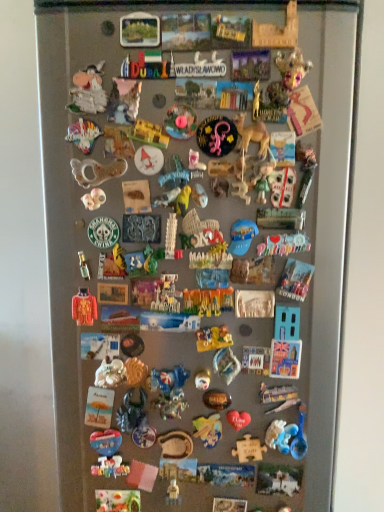
Question: Based on their sizes in the image, would you say white plastic puzzle piece at center-right, acting as the 15th toy starting from the bottom, is bigger or smaller than matte brown figurine at center, positioned as the 13th toy in bottom-to-top order?

Choices:
 (A) big
 (B) small

Answer: (A)

Question: Does point (274, 310) appear closer or farther from the camera than point (125, 343)?

Choices:
 (A) closer
 (B) farther

Answer: (A)

Question: Estimate the real-world distances between objects in this image. Which object is farther from the wooden puzzle piece at center, the 4th toy in the bottom-to-top sequence?

Choices:
 (A) white matte figurine at center, the eleventh toy when ordered from top to bottom
 (B) pink plastic toy at center, which is counted as the 34th toy, starting from the bottom
 (C) multicolored plastic toy at center, acting as the 18th toy starting from the bottom
 (D) wooden letter at center, the 38th toy ordered from the bottom
 (E) metallic silver spoon at upper left, acting as the 32th toy starting from the bottom

Answer: (D)

Question: Which object is the closest to the matte brown figurine at center, which appears as the ninth toy when viewed from the top?

Choices:
 (A) wooden puzzle piece at center, the 31th toy when ordered from top to bottom
 (B) matte plastic toy at center, the 20th toy from the top
 (C) translucent plastic toy at center, marked as the 10th toy in a bottom-to-top arrangement
 (D) wooden puzzle piece at center, the 4th toy in the bottom-to-top sequence
 (E) metallic silver puzzle piece at center, which is the 28th toy from top to bottom

Answer: (B)